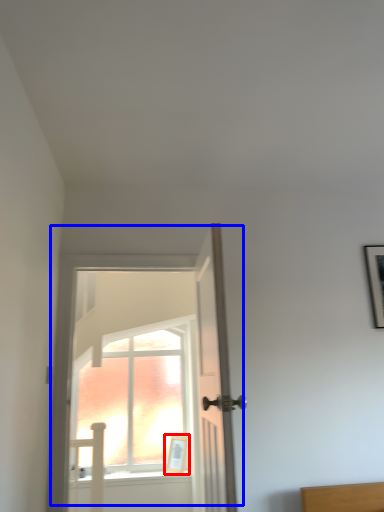
Question: Which object appears closest to the camera in this image, picture frame (highlighted by a red box) or door (highlighted by a blue box)?

Choices:
 (A) picture frame
 (B) door

Answer: (B)